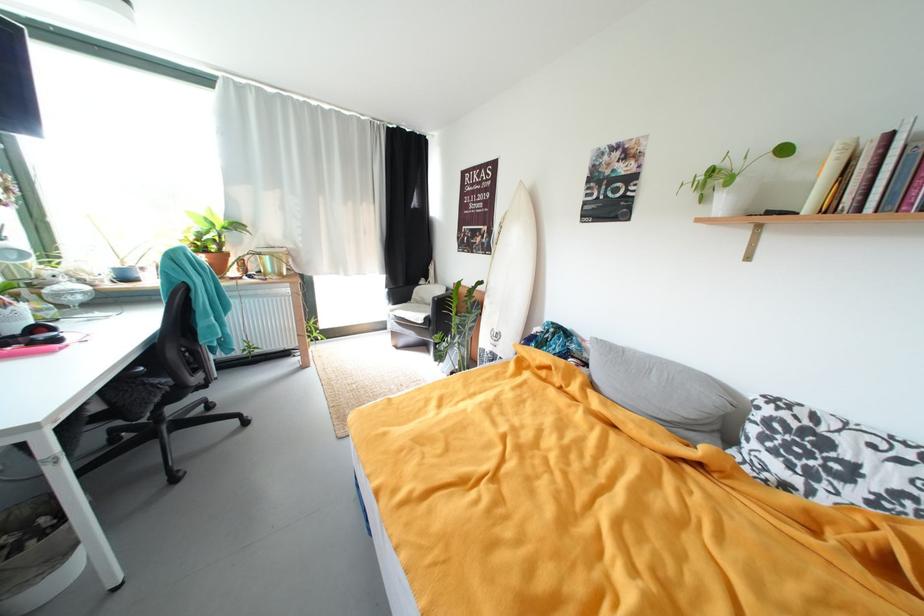
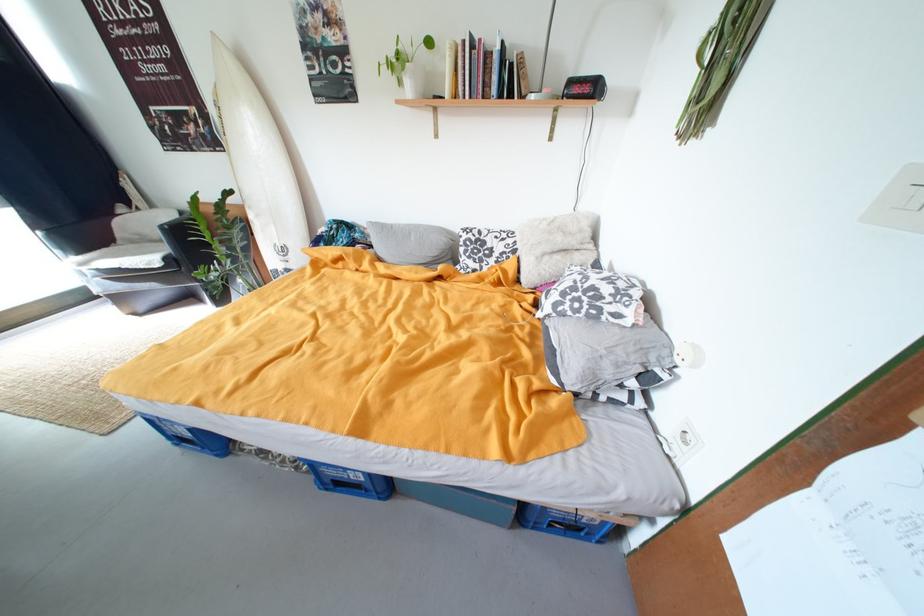
The point at (438,306) is marked in the first image. Where is the corresponding point in the second image?

(169, 243)